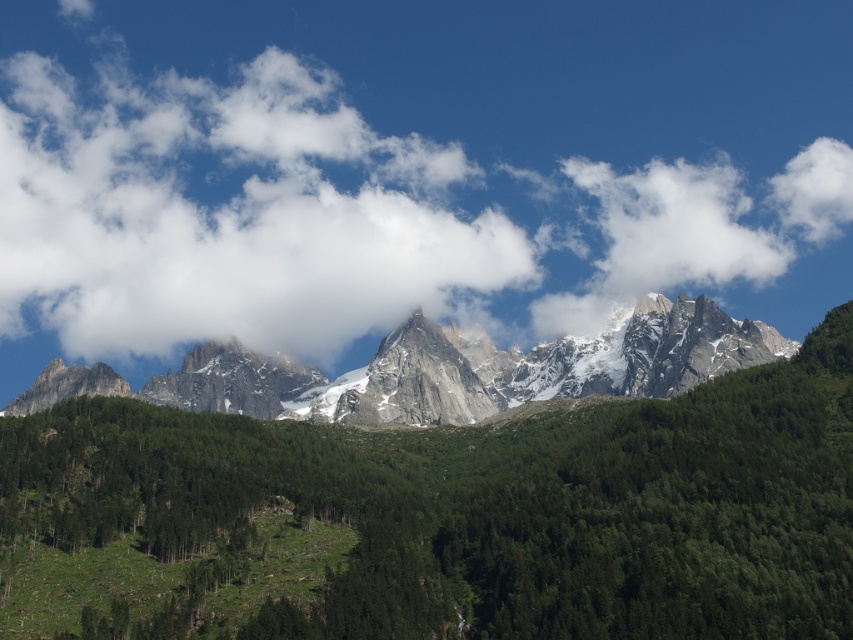
Can you confirm if white fluffy cloud at upper center is wider than green matte tree at center?

Correct, the width of white fluffy cloud at upper center exceeds that of green matte tree at center.

Does point (677, 285) lie in front of point (550, 588)?

No, (677, 285) is further to viewer.

Is point (329, 220) positioned in front of point (212, 576)?

No.

Where is `white fluffy cloud at upper center`? Image resolution: width=853 pixels, height=640 pixels. white fluffy cloud at upper center is located at coordinates (410, 170).

Is green matte tree at center taller than snowy granite mountain range at center?

Indeed, green matte tree at center has a greater height compared to snowy granite mountain range at center.

Is green matte tree at center below snowy granite mountain range at center?

Indeed, green matte tree at center is positioned under snowy granite mountain range at center.

Identify the location of green matte tree at center. (474, 509).

Between white fluffy cloud at upper center and snowy granite mountain range at center, which one is positioned higher?

white fluffy cloud at upper center

Locate an element on the screen. Image resolution: width=853 pixels, height=640 pixels. white fluffy cloud at upper center is located at coordinates (410, 170).

What are the coordinates of `white fluffy cloud at upper center` in the screenshot? It's located at (410, 170).